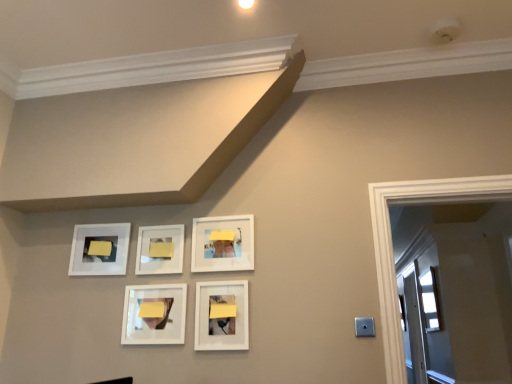
Question: From the image's perspective, is matte white picture frame at lower center, which is counted as the first picture frame, starting from the right, located beneath white matte picture frame at center, which is counted as the 3th picture frame, starting from the left?

Choices:
 (A) yes
 (B) no

Answer: (A)

Question: Would you say white matte picture frame at center, the 3th picture frame positioned from the right, is part of matte white picture frame at lower center, arranged as the 5th picture frame when viewed from the left,'s contents?

Choices:
 (A) yes
 (B) no

Answer: (B)

Question: Is matte white picture frame at lower center, arranged as the 5th picture frame when viewed from the left, thinner than white matte picture frame at center, which is counted as the 3th picture frame, starting from the left?

Choices:
 (A) yes
 (B) no

Answer: (B)

Question: Does matte white picture frame at lower center, arranged as the 5th picture frame when viewed from the left, have a larger size compared to white matte picture frame at center, which is counted as the 3th picture frame, starting from the left?

Choices:
 (A) no
 (B) yes

Answer: (B)

Question: Is matte white picture frame at lower center, arranged as the 5th picture frame when viewed from the left, facing towards white matte picture frame at center, which is counted as the 3th picture frame, starting from the left?

Choices:
 (A) yes
 (B) no

Answer: (B)

Question: Is white glossy picture frame at center, which appears as the second picture frame when viewed from the left, spatially inside yellow matte paper at center, the fourth lift ordered from the bottom, or outside of it?

Choices:
 (A) inside
 (B) outside

Answer: (B)

Question: Considering the positions of white glossy picture frame at center, which is the 4th picture frame in right-to-left order, and yellow matte paper at center, which is counted as the 1th lift, starting from the top, in the image, is white glossy picture frame at center, which is the 4th picture frame in right-to-left order, taller or shorter than yellow matte paper at center, which is counted as the 1th lift, starting from the top,?

Choices:
 (A) short
 (B) tall

Answer: (B)

Question: Does point (157, 289) appear closer or farther from the camera than point (169, 251)?

Choices:
 (A) farther
 (B) closer

Answer: (B)

Question: Looking at their shapes, would you say white glossy picture frame at center, which appears as the second picture frame when viewed from the left, is wider or thinner than yellow matte paper at center, the 2th lift viewed from the right?

Choices:
 (A) wide
 (B) thin

Answer: (A)

Question: Would you say yellow matte paper at center, arranged as the 3th lift when viewed from the front, is inside or outside yellow matte post-it note at upper left, the 1th lift when ordered from back to front?

Choices:
 (A) inside
 (B) outside

Answer: (B)

Question: Is yellow matte paper at center, the second lift viewed from the back, wider or thinner than yellow matte post-it note at upper left, which appears as the second lift when viewed from the top?

Choices:
 (A) thin
 (B) wide

Answer: (A)

Question: Is yellow matte paper at center, the fourth lift ordered from the bottom, to the left or to the right of yellow matte post-it note at upper left, the 1th lift when ordered from back to front, in the image?

Choices:
 (A) left
 (B) right

Answer: (B)

Question: Is yellow matte paper at center, the 2th lift viewed from the right, bigger or smaller than yellow matte post-it note at upper left, which ranks as the 4th lift in right-to-left order?

Choices:
 (A) small
 (B) big

Answer: (A)

Question: In the image, is yellow matte post-it note at upper left, which ranks as the 4th lift in right-to-left order, on the left side or the right side of yellow matte paper at center, the second lift viewed from the back?

Choices:
 (A) right
 (B) left

Answer: (B)

Question: Based on their sizes in the image, would you say yellow matte post-it note at upper left, the 1th lift when ordered from back to front, is bigger or smaller than yellow matte paper at center, which is counted as the 1th lift, starting from the top?

Choices:
 (A) big
 (B) small

Answer: (A)